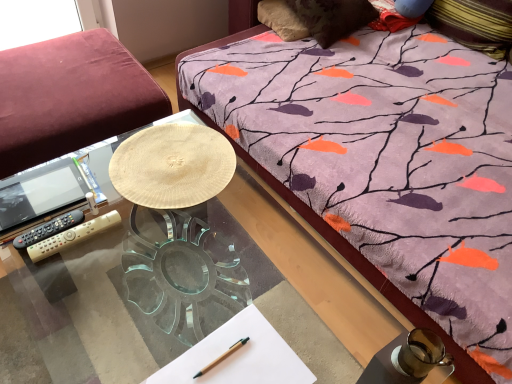
Image resolution: width=512 pixels, height=384 pixels. Identify the location of blank space situated above velvet burgundy studio couch at left (from a real-world perspective). (54, 73).